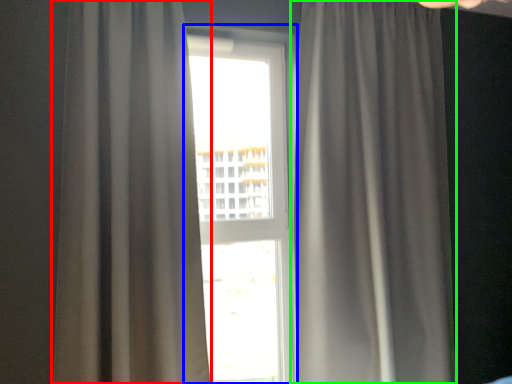
Question: Estimate the real-world distances between objects in this image. Which object is farther from curtain (highlighted by a red box), window (highlighted by a blue box) or curtain (highlighted by a green box)?

Choices:
 (A) window
 (B) curtain

Answer: (A)